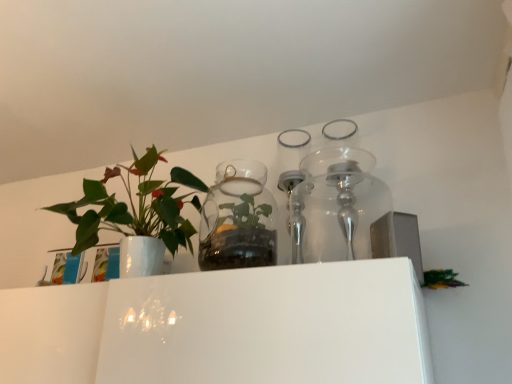
Question: Considering the relative sizes of transparent glass terrarium at center and white glossy vase at left in the image provided, is transparent glass terrarium at center smaller than white glossy vase at left?

Choices:
 (A) no
 (B) yes

Answer: (B)

Question: Can white glossy vase at left be found inside transparent glass terrarium at center?

Choices:
 (A) yes
 (B) no

Answer: (B)

Question: From a real-world perspective, is transparent glass terrarium at center on white glossy vase at left?

Choices:
 (A) no
 (B) yes

Answer: (A)

Question: Is transparent glass terrarium at center positioned before white glossy vase at left?

Choices:
 (A) yes
 (B) no

Answer: (B)

Question: Is transparent glass terrarium at center oriented towards white glossy vase at left?

Choices:
 (A) yes
 (B) no

Answer: (B)

Question: Is transparent glass terrarium at center completely or partially outside of white glossy vase at left?

Choices:
 (A) no
 (B) yes

Answer: (B)

Question: Is white glossy vase at left surrounding transparent glass terrarium at center?

Choices:
 (A) no
 (B) yes

Answer: (A)

Question: Does white glossy vase at left have a greater height compared to transparent glass terrarium at center?

Choices:
 (A) no
 (B) yes

Answer: (B)

Question: Is white glossy vase at left closer to camera compared to transparent glass terrarium at center?

Choices:
 (A) yes
 (B) no

Answer: (A)

Question: From the image's perspective, is white glossy vase at left on transparent glass terrarium at center?

Choices:
 (A) no
 (B) yes

Answer: (B)

Question: Is white glossy vase at left positioned behind transparent glass terrarium at center?

Choices:
 (A) yes
 (B) no

Answer: (B)

Question: Is the surface of white glossy vase at left in direct contact with transparent glass terrarium at center?

Choices:
 (A) yes
 (B) no

Answer: (B)

Question: Is transparent glass terrarium at center bigger or smaller than white glossy vase at left?

Choices:
 (A) small
 (B) big

Answer: (A)